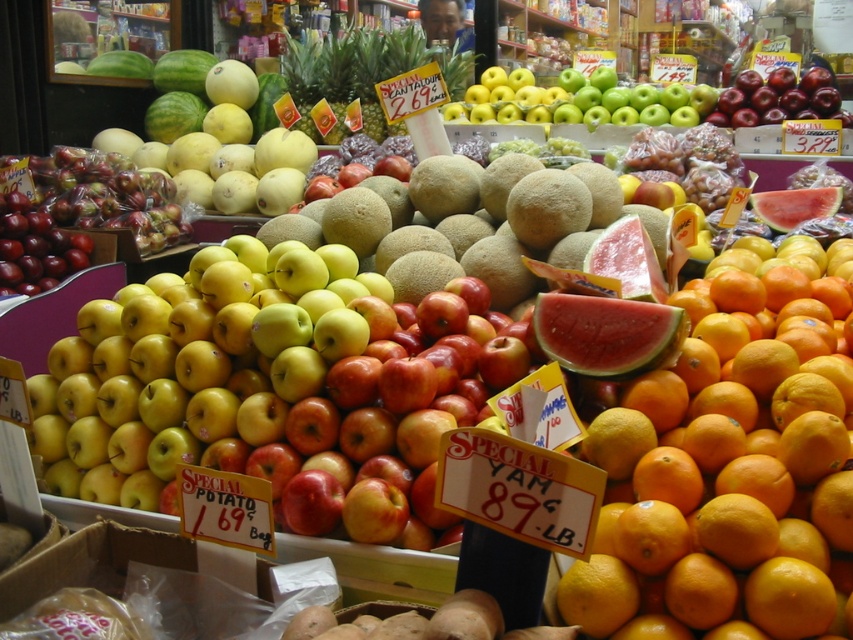
Question: Can you confirm if smooth yellow orange at center is smaller than watermelon rind at upper right?

Choices:
 (A) yes
 (B) no

Answer: (A)

Question: Which of the following is the closest to the observer?

Choices:
 (A) orangesmoothorange at right
 (B) shiny red apple at upper right
 (C) watermelon rind at center
 (D) yellow matte apples at center

Answer: (A)

Question: Estimate the real-world distances between objects in this image. Which object is closer to the watermelon rind at center?

Choices:
 (A) yellow matte apples at center
 (B) smooth yellow orange at center
 (C) watermelon rind at upper right

Answer: (A)

Question: Can you confirm if watermelon rind at center is smaller than watermelon rind at upper right?

Choices:
 (A) yes
 (B) no

Answer: (A)

Question: Does watermelon rind at center have a lesser width compared to shiny red apple at upper right?

Choices:
 (A) yes
 (B) no

Answer: (A)

Question: Considering the real-world distances, which object is farthest from the smooth yellow orange at center?

Choices:
 (A) watermelon rind at upper right
 (B) orangesmoothorange at right
 (C) watermelon rind at center

Answer: (A)